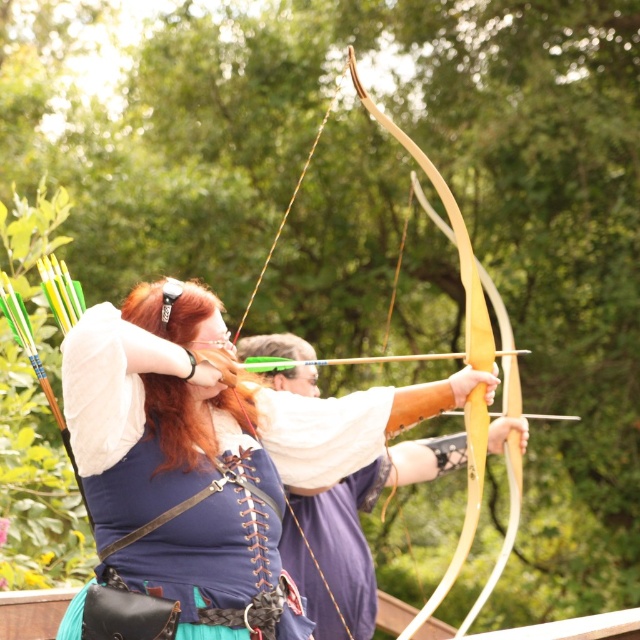
You are an archer standing at the center of the archery range. You notice two points marked in the scene. Which point is closer to you, point (96,435) or point (410,140)?

Point (96,435) is closer to the camera than point (410,140).

You are an archery instructor observing the scene. You need to determine which object is larger between the matte blue shirt at center and the natural wood bow at center. Which one is bigger?

The natural wood bow at center is larger than the matte blue shirt at center.